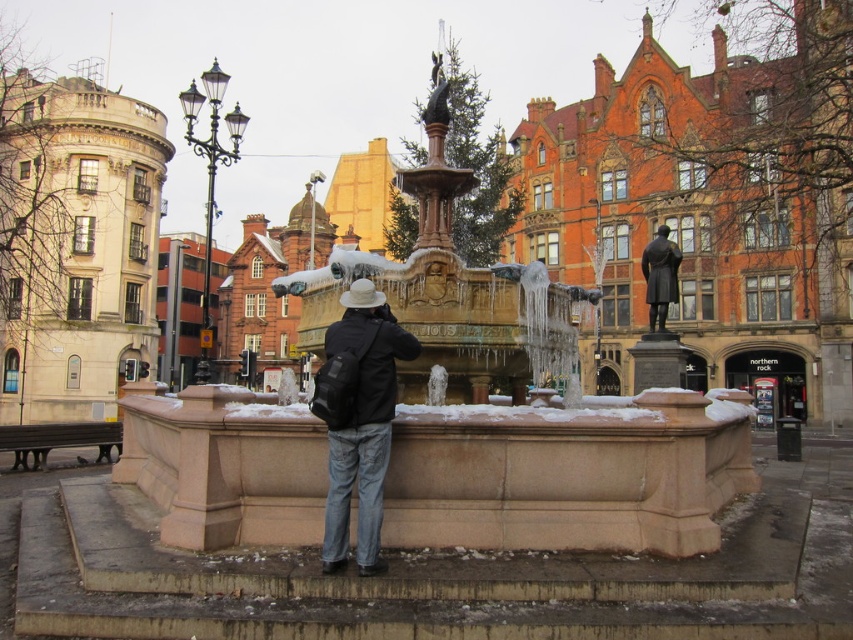
You are a photographer trying to capture the black polished statue at center without any obstructions. There is a person wearing a black matte jacket at center in the way. Can you adjust your position to the right to get a clear shot of the statue?

The black matte jacket at center is positioned under the black polished statue at center, so moving to the right might still leave the statue partially obscured. Adjust your angle or move further back to ensure the statue is fully visible.

You are a photographer standing at the edge of the square. You want to take a photo of the black polished statue at center without the black matte jacket at center appearing in the frame. Is it possible to do so from your current position?

The black matte jacket at center is 38.32 meters away from the black polished statue at center. Since the jacket is positioned between the photographer and the statue, it would likely block the view unless the photographer moves to a different angle or position where the statue is visible without the jacket obstructing it.